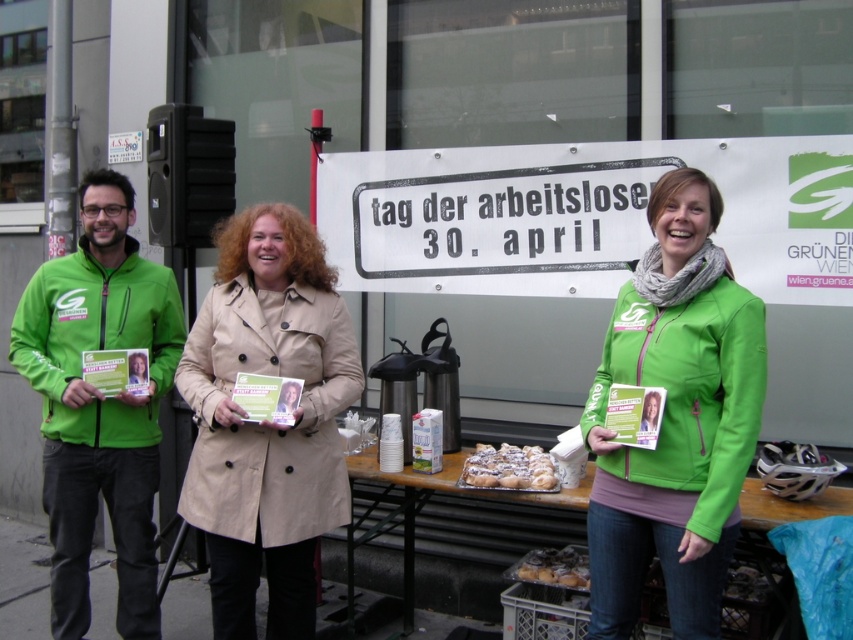
Question: Which object is the farthest from the green softshell jacket at center?

Choices:
 (A) beige trench coat at center
 (B) green fleece jacket at left
 (C) powdery white pastries at center
 (D) wooden table at center

Answer: (B)

Question: Considering the real-world distances, which object is closest to the wooden table at center?

Choices:
 (A) green softshell jacket at center
 (B) golden glazed donuts at center
 (C) beige trench coat at center

Answer: (B)

Question: Is green softshell jacket at center to the left of golden glazed donuts at center from the viewer's perspective?

Choices:
 (A) yes
 (B) no

Answer: (B)

Question: Among these objects, which one is nearest to the camera?

Choices:
 (A) powdery white pastries at center
 (B) beige trench coat at center

Answer: (B)

Question: Does green softshell jacket at center have a larger size compared to wooden table at center?

Choices:
 (A) yes
 (B) no

Answer: (B)

Question: Considering the relative positions of green fleece jacket at left and powdery white pastries at center in the image provided, where is green fleece jacket at left located with respect to powdery white pastries at center?

Choices:
 (A) above
 (B) below

Answer: (A)